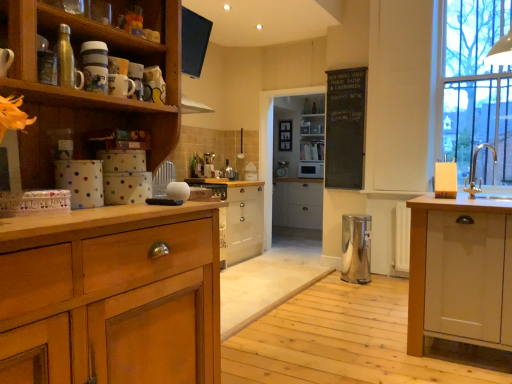
The height and width of the screenshot is (384, 512). What are the coordinates of `white wood cabinet at center, the second cabinetry viewed from the left` in the screenshot? It's located at (296, 158).

Describe the element at coordinates (311, 169) in the screenshot. The image size is (512, 384). I see `white glossy microwave at center, placed as the 4th appliance when sorted from front to back` at that location.

In order to face white glossy toaster at center, placed as the 3th appliance when sorted from right to left, should I rotate leftwards or rightwards?

Turn left by 0.739 degrees to look at white glossy toaster at center, placed as the 3th appliance when sorted from right to left.

Describe the element at coordinates (111, 296) in the screenshot. I see `wooden cabinet at left` at that location.

You are a GUI agent. You are given a task and a screenshot of the screen. Output one action in this format:
    pyautogui.click(x=<x>, y=<y>)
    Task: Click on the wooden cabinet at left
    The image size is (512, 384).
    Given the screenshot: What is the action you would take?
    pyautogui.click(x=111, y=296)

The height and width of the screenshot is (384, 512). I want to click on polished stainless steel trash can at center, marked as the first appliance in a bottom-to-top arrangement, so click(356, 248).

You are a GUI agent. You are given a task and a screenshot of the screen. Output one action in this format:
    pyautogui.click(x=<x>, y=<y>)
    Task: Click on the wooden cabinet at center, the 1th cabinetry from the left
    
    Given the screenshot: What is the action you would take?
    pyautogui.click(x=238, y=216)

Locate an element on the screen. This screenshot has height=384, width=512. metallic silver water bottle at upper left, arranged as the 1th appliance when viewed from the left is located at coordinates coord(67,61).

Is wooden cabinet at center, the second cabinetry positioned from the right, taller or shorter than wooden cabinet at left?

Clearly, wooden cabinet at center, the second cabinetry positioned from the right, is shorter compared to wooden cabinet at left.

Considering the positions of objects wooden cabinet at center, the 1th cabinetry from the left, and wooden cabinet at left in the image provided, who is more to the left, wooden cabinet at center, the 1th cabinetry from the left, or wooden cabinet at left?

wooden cabinet at left is more to the left.

From the image's perspective, which is above, wooden cabinet at center, the second cabinetry positioned from the right, or wooden cabinet at left?

wooden cabinet at left appears higher in the image.

How many degrees apart are the facing directions of wooden cabinet at center, the second cabinetry positioned from the right, and wooden cabinet at left?

The angle between the facing direction of wooden cabinet at center, the second cabinetry positioned from the right, and the facing direction of wooden cabinet at left is 0.88 degrees.

Is wooden cabinet at left further to camera compared to silver metallic sink at right?

No, wooden cabinet at left is closer to the viewer.

Measure the distance between wooden cabinet at left and silver metallic sink at right.

A distance of 2.17 meters exists between wooden cabinet at left and silver metallic sink at right.

Does wooden cabinet at left have a larger size compared to silver metallic sink at right?

Indeed, wooden cabinet at left has a larger size compared to silver metallic sink at right.

Is wooden cabinet at left inside or outside of silver metallic sink at right?

wooden cabinet at left is outside silver metallic sink at right.

From the image's perspective, which object appears higher, wooden shelf at center or white glossy toaster at center, the second appliance positioned from the back?

wooden shelf at center.

Image resolution: width=512 pixels, height=384 pixels. Find the location of `the 2nd appliance to the left of the wooden shelf at center, starting your count from the anchor`. the 2nd appliance to the left of the wooden shelf at center, starting your count from the anchor is located at coordinates (250, 172).

Considering the positions of point (303, 159) and point (251, 169), is point (303, 159) closer or farther from the camera than point (251, 169)?

Point (303, 159) is positioned farther from the camera compared to point (251, 169).

Consider the image. Is wooden shelf at center completely or partially outside of white glossy toaster at center, the second appliance positioned from the back?

Yes.

Is black chalkboard at upper center at the back of white wood cabinet at center, arranged as the first cabinetry when viewed from the right?

No, white wood cabinet at center, arranged as the first cabinetry when viewed from the right, is not facing the opposite direction of black chalkboard at upper center.

Consider the image. Considering the relative positions of white wood cabinet at center, the second cabinetry viewed from the left, and black chalkboard at upper center in the image provided, is white wood cabinet at center, the second cabinetry viewed from the left, in front of black chalkboard at upper center?

No, white wood cabinet at center, the second cabinetry viewed from the left, is further to the viewer.

Is white wood cabinet at center, arranged as the first cabinetry when viewed from the right, not within black chalkboard at upper center?

white wood cabinet at center, arranged as the first cabinetry when viewed from the right, is positioned outside black chalkboard at upper center.

Considering the relative sizes of white wood cabinet at center, the second cabinetry viewed from the left, and black chalkboard at upper center in the image provided, is white wood cabinet at center, the second cabinetry viewed from the left, bigger than black chalkboard at upper center?

Yes.

Does silver metallic sink at right touch black chalkboard at upper center?

They are not placed beside each other.

From a real-world perspective, is silver metallic sink at right under black chalkboard at upper center?

Yes, from a real-world perspective, silver metallic sink at right is below black chalkboard at upper center.

Does silver metallic sink at right turn towards black chalkboard at upper center?

No, silver metallic sink at right is not oriented towards black chalkboard at upper center.

Does silver metallic sink at right have a larger size compared to black chalkboard at upper center?

No, silver metallic sink at right is not bigger than black chalkboard at upper center.

Considering the relative sizes of wooden cabinet at left and wooden cabinet at center, the second cabinetry positioned from the right, in the image provided, is wooden cabinet at left wider than wooden cabinet at center, the second cabinetry positioned from the right,?

In fact, wooden cabinet at left might be narrower than wooden cabinet at center, the second cabinetry positioned from the right.

From the image's perspective, which one is positioned lower, wooden cabinet at left or wooden cabinet at center, the second cabinetry positioned from the right?

wooden cabinet at center, the second cabinetry positioned from the right, appears lower in the image.

Is wooden cabinet at left positioned in front of wooden cabinet at center, the second cabinetry positioned from the right?

That is True.

Considering the relative sizes of wooden cabinet at left and wooden cabinet at center, the 1th cabinetry from the left, in the image provided, is wooden cabinet at left smaller than wooden cabinet at center, the 1th cabinetry from the left,?

Incorrect, wooden cabinet at left is not smaller in size than wooden cabinet at center, the 1th cabinetry from the left.

Considering the relative positions of wooden shelf at center and white glossy microwave at center, the 1th appliance when ordered from back to front, in the image provided, is wooden shelf at center behind white glossy microwave at center, the 1th appliance when ordered from back to front,?

Yes, wooden shelf at center is behind white glossy microwave at center, the 1th appliance when ordered from back to front.

From a real-world perspective, does wooden shelf at center sit lower than white glossy microwave at center, marked as the second appliance in a top-to-bottom arrangement?

No, from a real-world perspective, wooden shelf at center is not below white glossy microwave at center, marked as the second appliance in a top-to-bottom arrangement.

Considering the sizes of wooden shelf at center and white glossy microwave at center, arranged as the third appliance when ordered from the bottom, in the image, is wooden shelf at center taller or shorter than white glossy microwave at center, arranged as the third appliance when ordered from the bottom,?

Considering their sizes, wooden shelf at center has more height than white glossy microwave at center, arranged as the third appliance when ordered from the bottom.

The image size is (512, 384). In order to click on cupboard that appears above the wooden cabinet at center, the second cabinetry positioned from the right (from a real-world perspective) in this screenshot , I will do `click(111, 296)`.

This screenshot has height=384, width=512. I want to click on sink located on the right of wooden cabinet at left, so point(475,170).

Considering their positions, is white glossy toaster at center, which is counted as the 2th appliance, starting from the left, positioned closer to clear glass window at right than polished stainless steel trash can at center, which is counted as the second appliance, starting from the front?

polished stainless steel trash can at center, which is counted as the second appliance, starting from the front.

Considering their positions, is wooden cabinet at center, the second cabinetry positioned from the right, positioned further to metallic silver coffee machine at center than clear glass window at right?

Based on the image, clear glass window at right appears to be further to metallic silver coffee machine at center.

When comparing their distances from black chalkboard at upper center, does wooden shelf at center or white wood cabinet at center, arranged as the first cabinetry when viewed from the right, seem closer?

white wood cabinet at center, arranged as the first cabinetry when viewed from the right, is closer to black chalkboard at upper center.

When comparing their distances from silver metallic sink at right, does wooden cabinet at center, the 1th cabinetry from the left, or white glossy sink at right seem closer?

white glossy sink at right is closer to silver metallic sink at right.

Which object lies further to the anchor point white glossy microwave at center, the second appliance viewed from the right, white glossy toaster at center, acting as the 3th appliance starting from the top, or wooden cabinet at left?

wooden cabinet at left is further to white glossy microwave at center, the second appliance viewed from the right.

Considering their positions, is silver metallic sink at right positioned closer to clear glass window at right than wooden cabinet at center, the 1th cabinetry from the left?

Among the two, silver metallic sink at right is located nearer to clear glass window at right.

Which object lies further to the anchor point black chalkboard at upper center, white glossy microwave at center, the 1th appliance when ordered from back to front, or polished stainless steel trash can at center, which ranks as the 1th appliance in right-to-left order?

white glossy microwave at center, the 1th appliance when ordered from back to front, is positioned further to the anchor black chalkboard at upper center.

Looking at the image, which one is located further to black chalkboard at upper center, white glossy sink at right or white glossy toaster at center, the second appliance positioned from the back?

white glossy sink at right.

Locate an element on the screen. The height and width of the screenshot is (384, 512). sink between metallic silver water bottle at upper left, which is counted as the fourth appliance, starting from the back, and white glossy microwave at center, the 1th appliance when ordered from back to front, in the front-back direction is located at coordinates (475, 170).

Identify the location of window between metallic silver water bottle at upper left, arranged as the 1th appliance when viewed from the left, and wooden shelf at center in the front-back direction. (474, 84).

Identify the location of cabinetry between white glossy toaster at center, placed as the 3th appliance when sorted from right to left, and white glossy sink at right. The width and height of the screenshot is (512, 384). click(296, 158).

The height and width of the screenshot is (384, 512). Identify the location of appliance positioned between metallic silver water bottle at upper left, which is counted as the fourth appliance, starting from the back, and white glossy toaster at center, which is counted as the 2th appliance, starting from the left, from near to far. (356, 248).